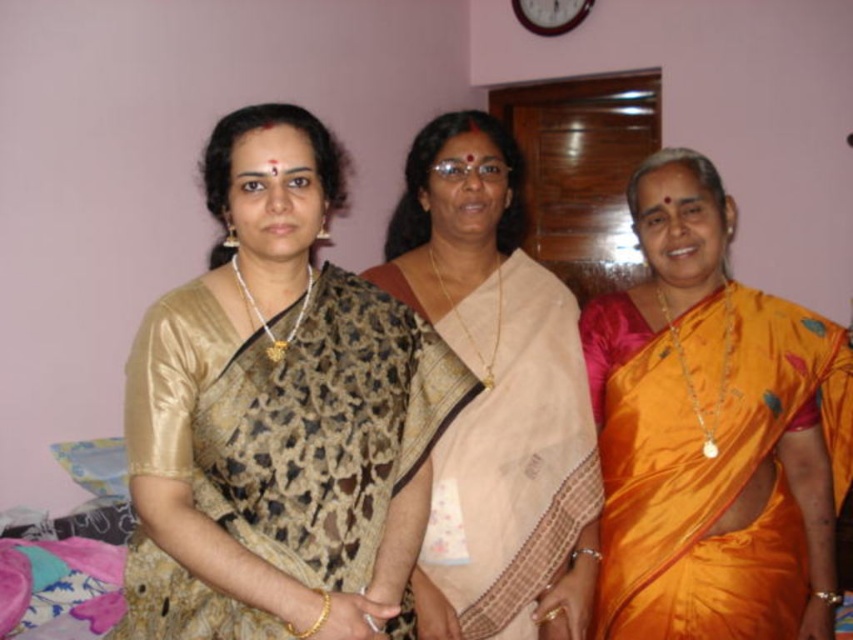
You are a photographer trying to capture a clear photo of the orange satin saree at right and the beige silk saree at center. Which saree is closer to the camera?

The orange satin saree at right is positioned under the beige silk saree at center, so the beige silk saree at center is closer to the camera.

You are standing in the room where the three women are. You want to give a gift to the woman wearing the gold silk saree at left. Which direction should you walk to reach her?

The gold silk saree at left is located at point 0.652 on the x axis and 0.328 on the y axis. Since the woman is on the left side of the image, you should walk to your left to reach her.